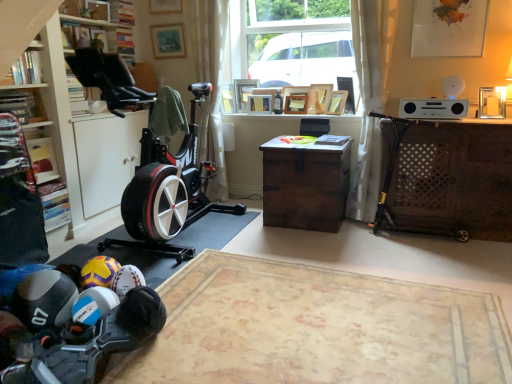
This screenshot has width=512, height=384. Identify the location of free space on the front side of brown wooden desk at center, the 1th desk in the left-to-right sequence. (311, 245).